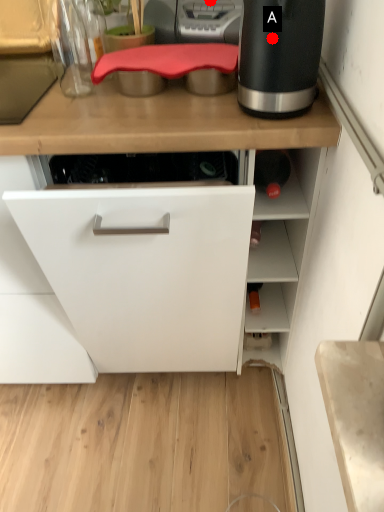
Question: Two points are circled on the image, labeled by A and B beside each circle. Which of the following is the closest to the observer?

Choices:
 (A) A is closer
 (B) B is closer

Answer: (A)